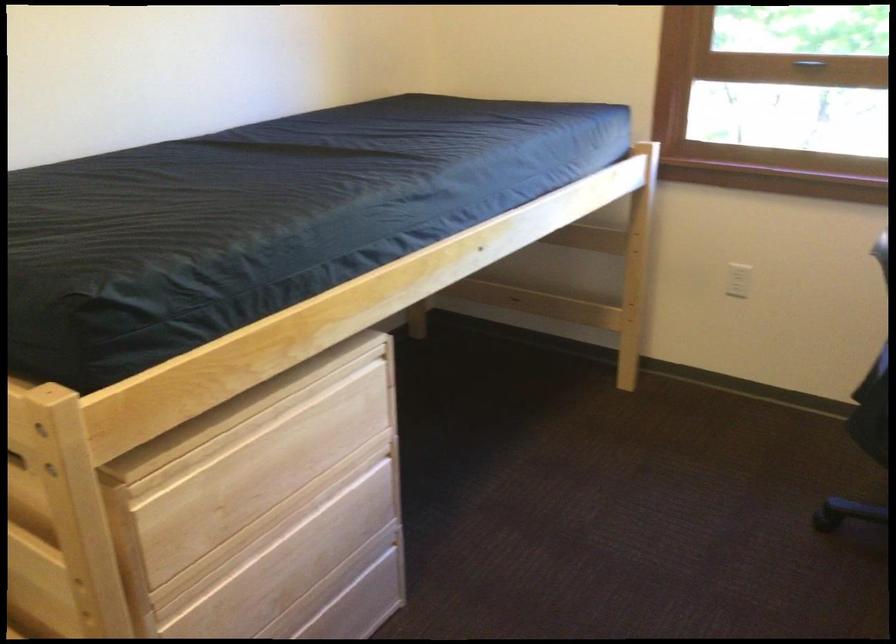
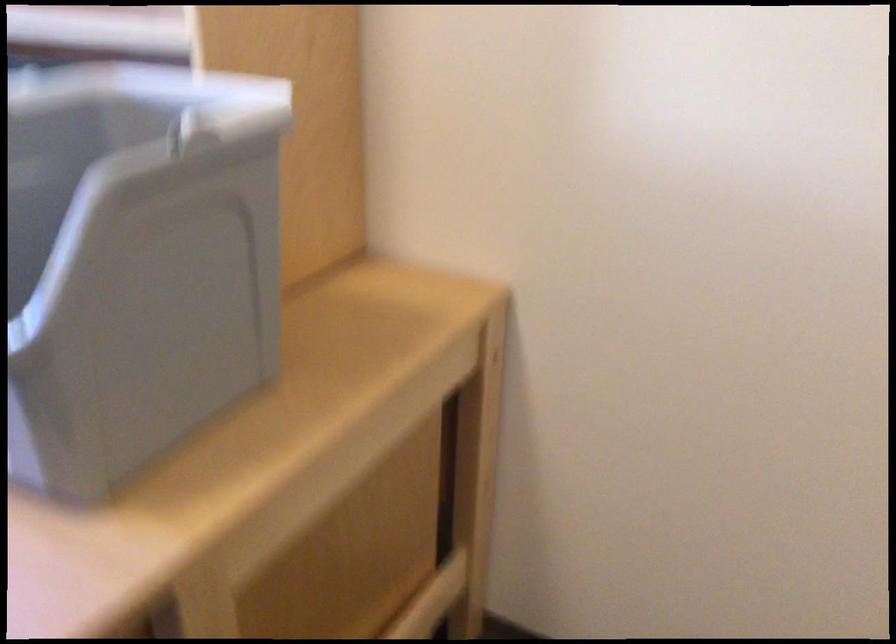
How did the camera likely rotate?

The rotation direction of the camera is right-down.